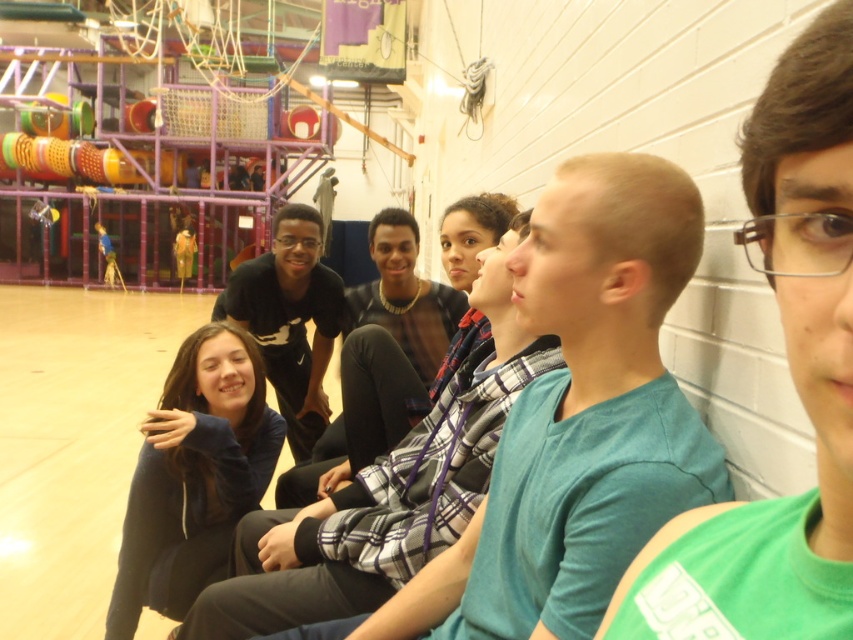
Image resolution: width=853 pixels, height=640 pixels. Describe the element at coordinates (576, 420) in the screenshot. I see `teal cotton shirt at center` at that location.

Does teal cotton shirt at center have a larger size compared to green fabric shirt at right?

Yes.

Between point (653, 280) and point (677, 616), which one is positioned in front?

Point (677, 616) is in front.

I want to click on teal cotton shirt at center, so click(576, 420).

Who is more forward, (636,291) or (112,616)?

Point (636,291) is more forward.

The width and height of the screenshot is (853, 640). In order to click on teal cotton shirt at center in this screenshot , I will do `click(576, 420)`.

Consider the image. Can you confirm if green fabric shirt at right is wider than dark blue hoodie at center?

Incorrect, green fabric shirt at right's width does not surpass dark blue hoodie at center's.

Between point (708, 545) and point (175, 381), which one is positioned behind?

The point (175, 381) is more distant.

You are a GUI agent. You are given a task and a screenshot of the screen. Output one action in this format:
    pyautogui.click(x=<x>, y=<y>)
    Task: Click on the green fabric shirt at right
    This screenshot has width=853, height=640.
    Given the screenshot: What is the action you would take?
    pyautogui.click(x=791, y=378)